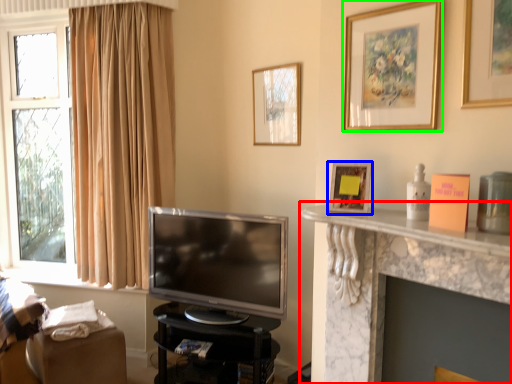
Question: Which is nearer to the shelf (highlighted by a red box)? picture frame (highlighted by a blue box) or picture frame (highlighted by a green box).

Choices:
 (A) picture frame
 (B) picture frame

Answer: (A)